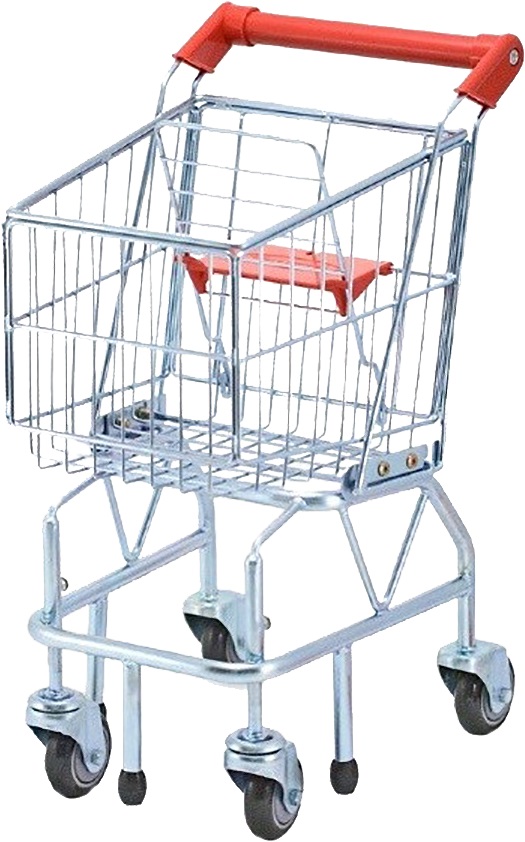
You are a GUI agent. You are given a task and a screenshot of the screen. Output one action in this format:
    pyautogui.click(x=<x>, y=<y>)
    Task: Click on the plastic covers
    This screenshot has width=525, height=842.
    Given the screenshot: What is the action you would take?
    pyautogui.click(x=344, y=777), pyautogui.click(x=134, y=790)